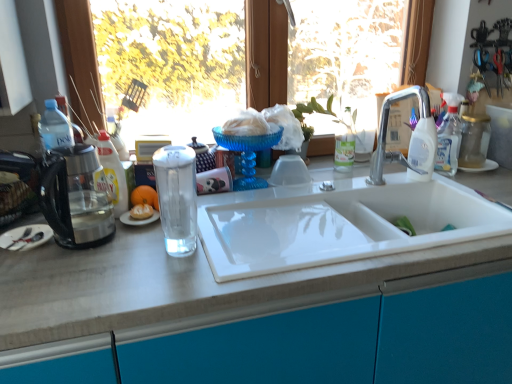
Find the location of `vacant area that is situated to the right of clear glass water at center`. vacant area that is situated to the right of clear glass water at center is located at coordinates (246, 242).